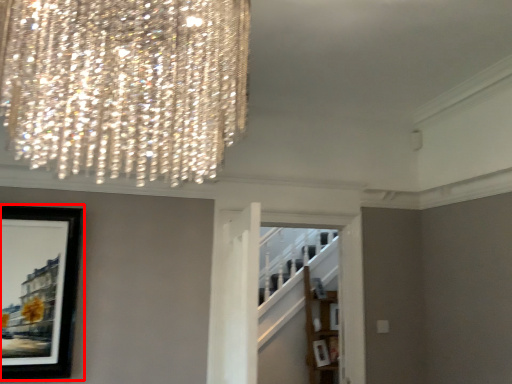
Question: From the image, what is the correct spatial relationship of picture frame (annotated by the red box) in relation to shelf?

Choices:
 (A) left
 (B) right

Answer: (A)